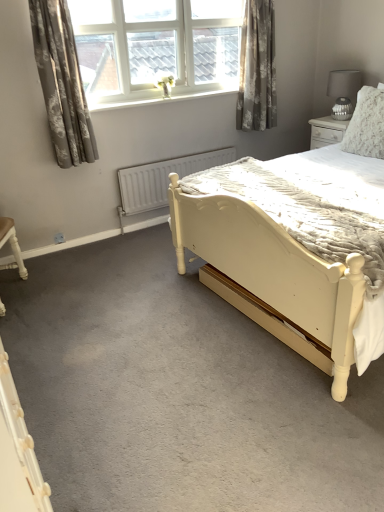
The image size is (384, 512). Identify the location of free spot below floral gray curtain at upper left, positioned as the second curtain in right-to-left order (from a real-world perspective). (91, 244).